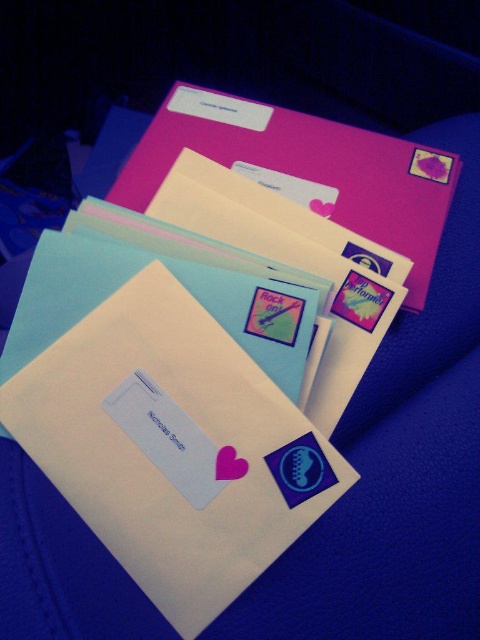
You are organizing a mail delivery and need to place the white paper envelope at center and the matte pink envelope at upper center into a box. Which envelope will require a larger space in the box?

The matte pink envelope at upper center requires a larger space in the box because it is bigger than the white paper envelope at center.

You are organizing a mail delivery and need to place the white paper envelope at center and the matte pink envelope at upper center into a narrow slot. Which envelope should you choose to fit better in the slot?

The white paper envelope at center has a smaller width compared to the matte pink envelope at upper center, so it will fit better in the narrow slot.

You are organizing a mail delivery and need to place a new envelope between the white paper envelope at center and the matte pink envelope at upper center. Given that the new envelope is 5.5 inches thick, will there be enough space between them to fit it?

The white paper envelope at center is 10.79 inches away from the matte pink envelope at upper center. Since the new envelope is 5.5 inches thick, there is sufficient space between them to fit it as 5.5 is less than 10.79.